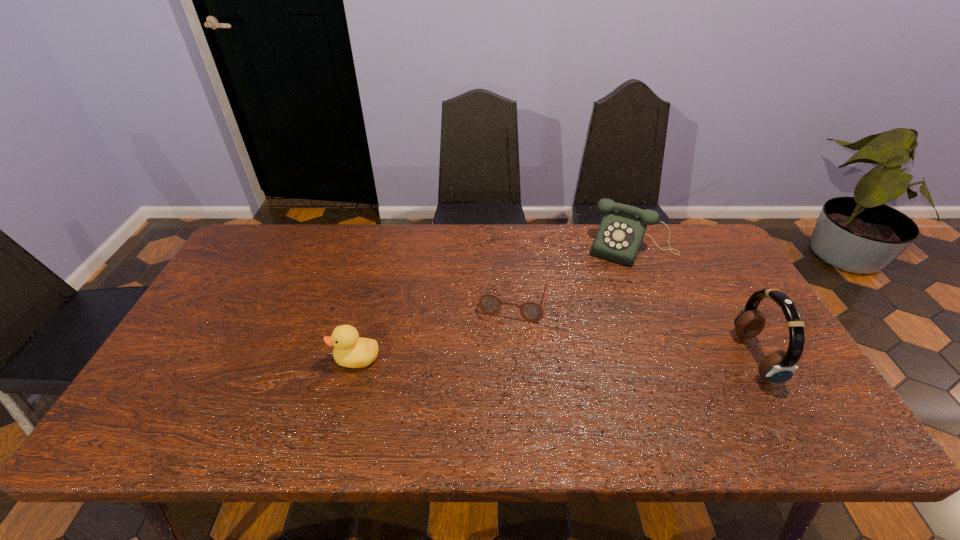
Find the location of a particular element. duckling is located at coordinates (350, 350).

This screenshot has height=540, width=960. I want to click on the leftmost object, so click(350, 350).

Identify the location of the tallest object. Image resolution: width=960 pixels, height=540 pixels. (778, 367).

This screenshot has width=960, height=540. Find the location of `headset`. headset is located at coordinates (778, 367).

Locate an element on the screen. the second object from right to left is located at coordinates (620, 234).

Where is `the third shortest object`? the third shortest object is located at coordinates (620, 234).

Identify the location of spectacles. This screenshot has height=540, width=960. tap(532, 311).

Where is `the shortest object`? The height and width of the screenshot is (540, 960). the shortest object is located at coordinates (532, 311).

Where is `free spot located on the face of the leftmost object`? free spot located on the face of the leftmost object is located at coordinates (192, 359).

The height and width of the screenshot is (540, 960). I want to click on vacant space located on the face of the leftmost object, so point(235,359).